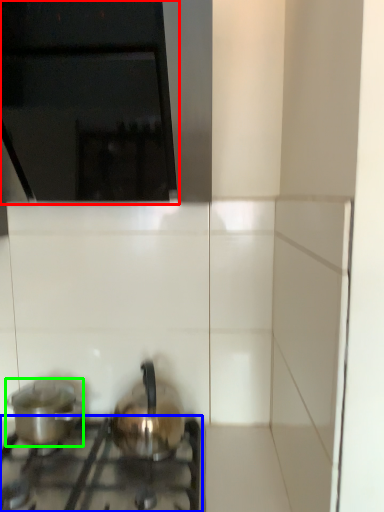
Question: Which is nearer to the vent (highlighted by a red box)? gas stove (highlighted by a blue box) or kitchen appliance (highlighted by a green box).

Choices:
 (A) gas stove
 (B) kitchen appliance

Answer: (B)